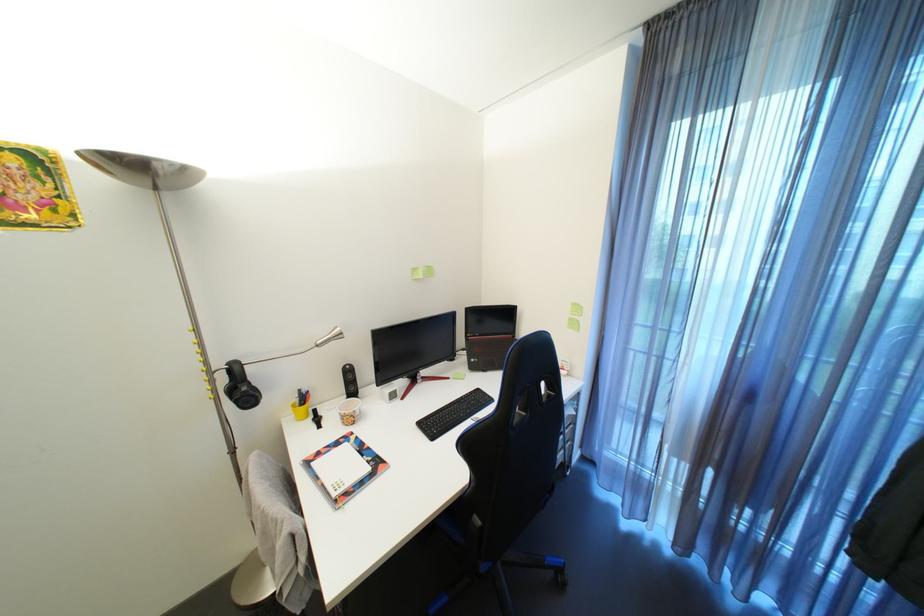
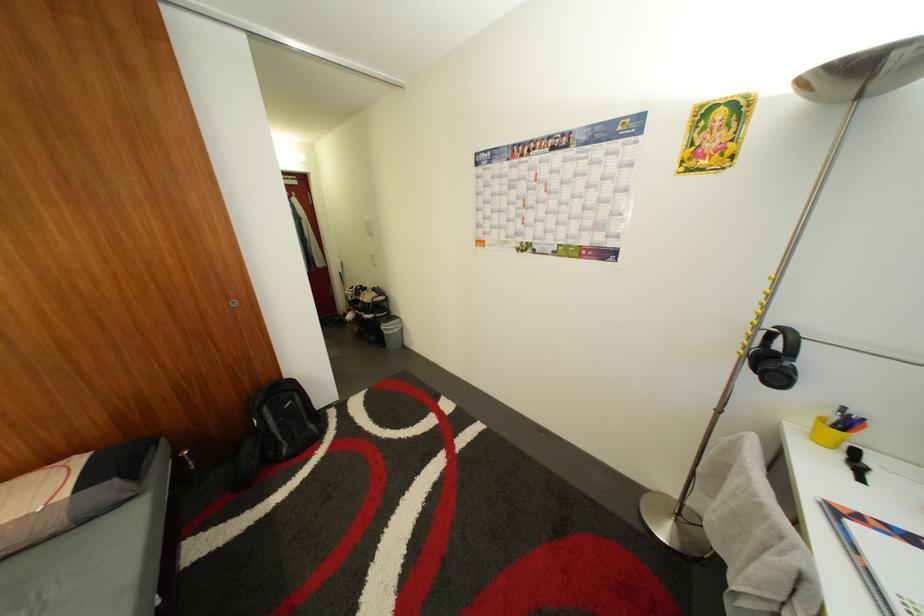
How did the camera likely rotate?

The rotation direction of the camera is left-down.